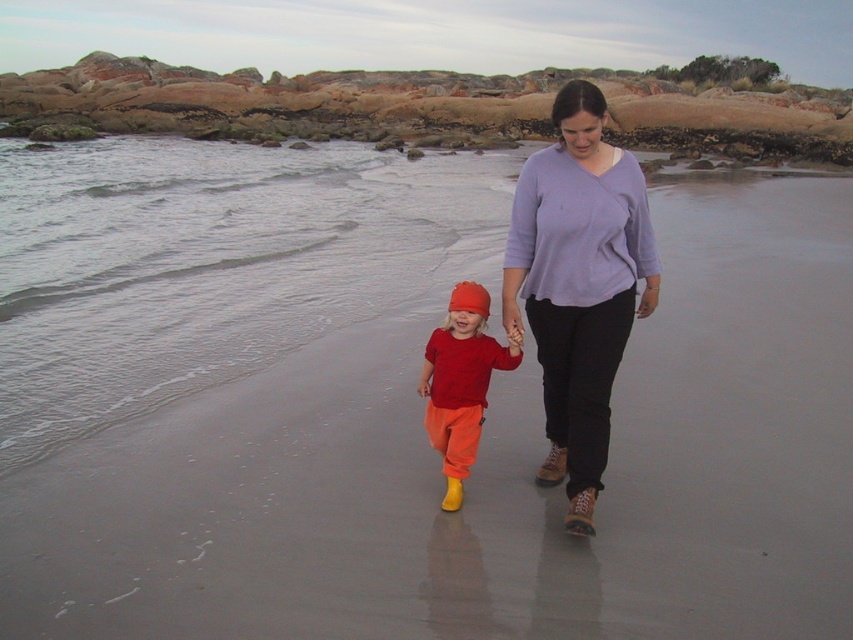
Question: Is clear water at lower left bigger than matte orange pants at center?

Choices:
 (A) no
 (B) yes

Answer: (B)

Question: Which object is the farthest from the clear water at lower left?

Choices:
 (A) matte purple sweater at center
 (B) matte orange pants at center

Answer: (A)

Question: Does clear water at lower left appear over matte orange pants at center?

Choices:
 (A) no
 (B) yes

Answer: (B)

Question: Which point is closer to the camera?

Choices:
 (A) (248, 326)
 (B) (460, 394)
 (C) (581, 234)

Answer: (C)

Question: From the image, what is the correct spatial relationship of clear water at lower left in relation to matte orange pants at center?

Choices:
 (A) above
 (B) below

Answer: (A)

Question: Which object is closer to the camera taking this photo?

Choices:
 (A) matte orange pants at center
 (B) clear water at lower left
 (C) matte purple sweater at center

Answer: (A)